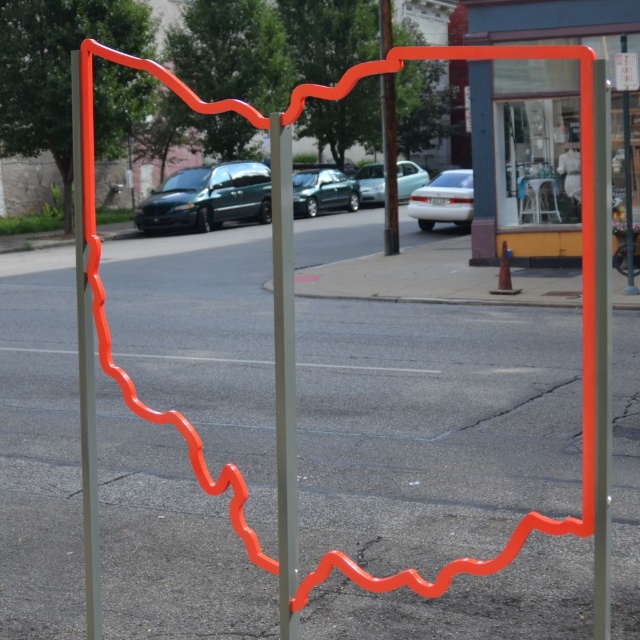
Does matte orange pole at left appear over green matte van at center?

Incorrect, matte orange pole at left is not positioned above green matte van at center.

Is matte orange pole at left below green matte van at center?

Indeed, matte orange pole at left is positioned under green matte van at center.

This screenshot has width=640, height=640. I want to click on matte orange pole at left, so click(x=84, y=372).

The height and width of the screenshot is (640, 640). Describe the element at coordinates (208, 196) in the screenshot. I see `green matte van at center` at that location.

Which is in front, point (182, 198) or point (390, 221)?

Point (390, 221) is more forward.

Where is `green matte van at center`? This screenshot has width=640, height=640. green matte van at center is located at coordinates (208, 196).

Is orange glossy swing at center smaller than metallic green car at center?

No, orange glossy swing at center is not smaller than metallic green car at center.

Looking at this image, can you confirm if orange glossy swing at center is shorter than metallic green car at center?

Incorrect, orange glossy swing at center's height does not fall short of metallic green car at center's.

Measure the distance between point (420,376) and camera.

14.80 meters

Where is `orange glossy swing at center`? Image resolution: width=640 pixels, height=640 pixels. orange glossy swing at center is located at coordinates (433, 428).